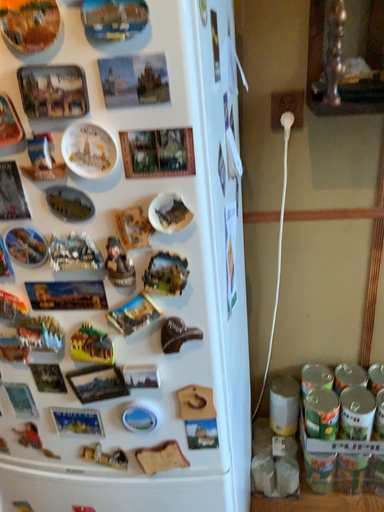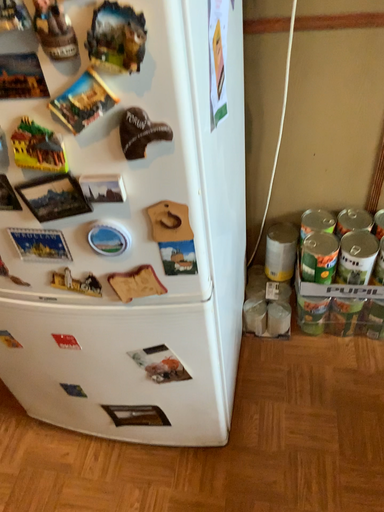
Question: How did the camera likely rotate when shooting the video?

Choices:
 (A) rotated upward
 (B) rotated downward

Answer: (B)